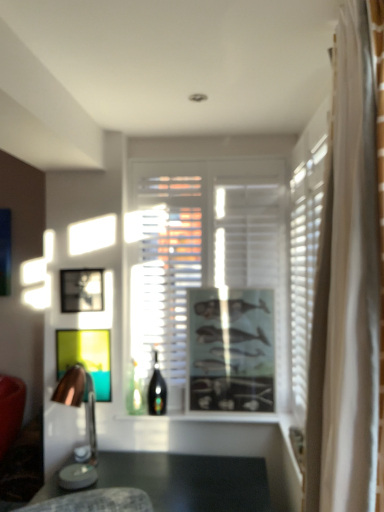
I want to click on vacant area on top of transparent glass window at center (from a real-world perspective), so click(x=211, y=148).